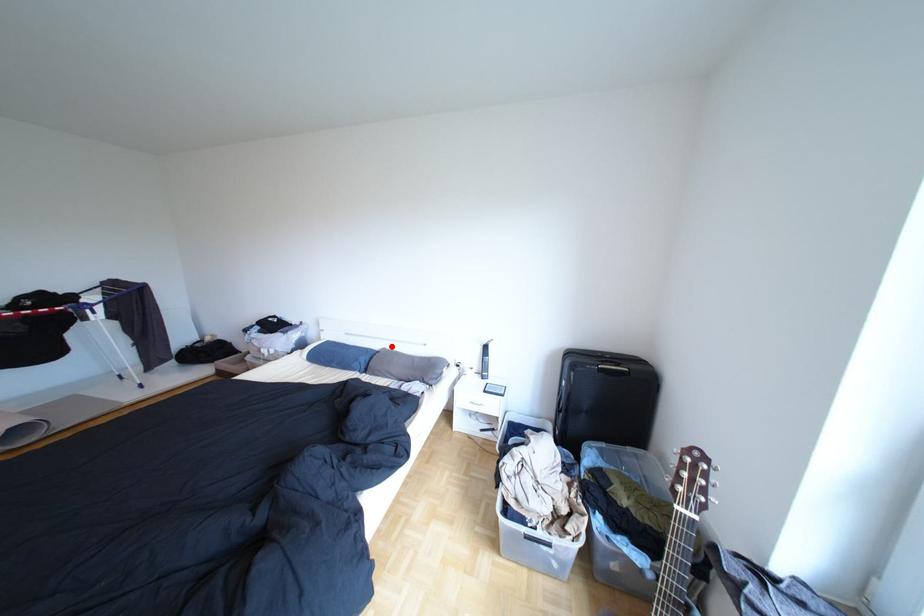
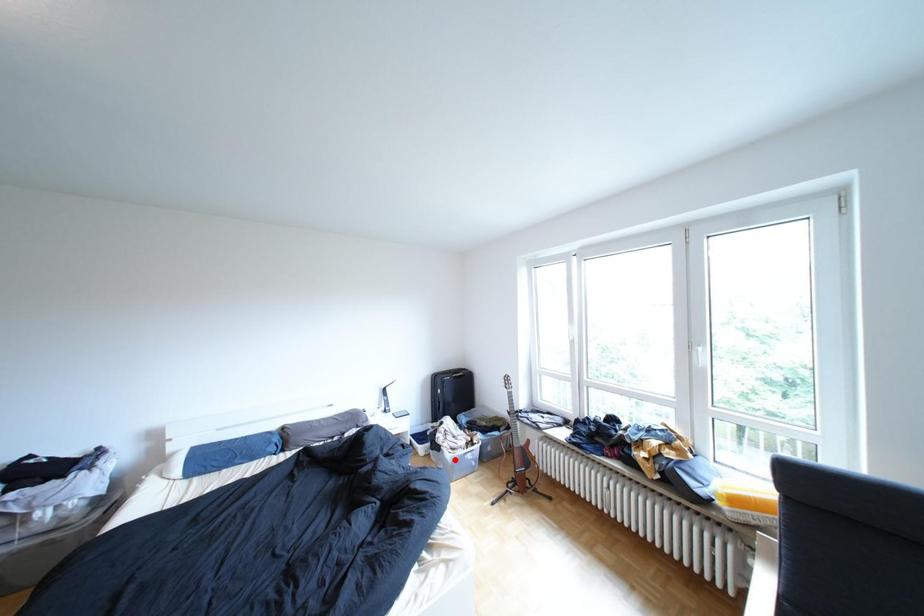
I am providing you with two images of the same scene from different viewpoints. A red point is marked on the first image and another point is marked on the second image. Is the red point in image1 aligned with the point shown in image2?

No